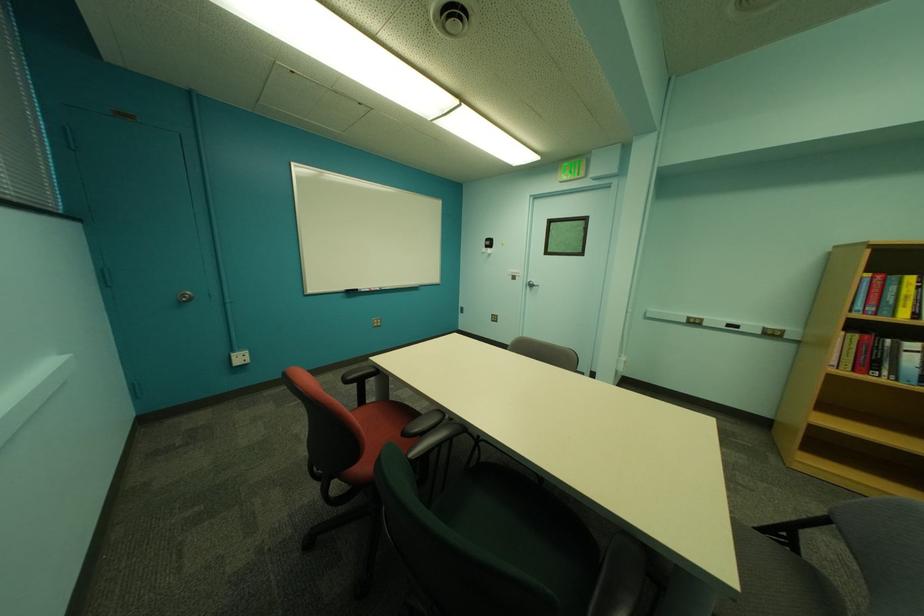
Locate an element on the screen. Image resolution: width=924 pixels, height=616 pixels. gray chair sitting surface is located at coordinates (513, 517).